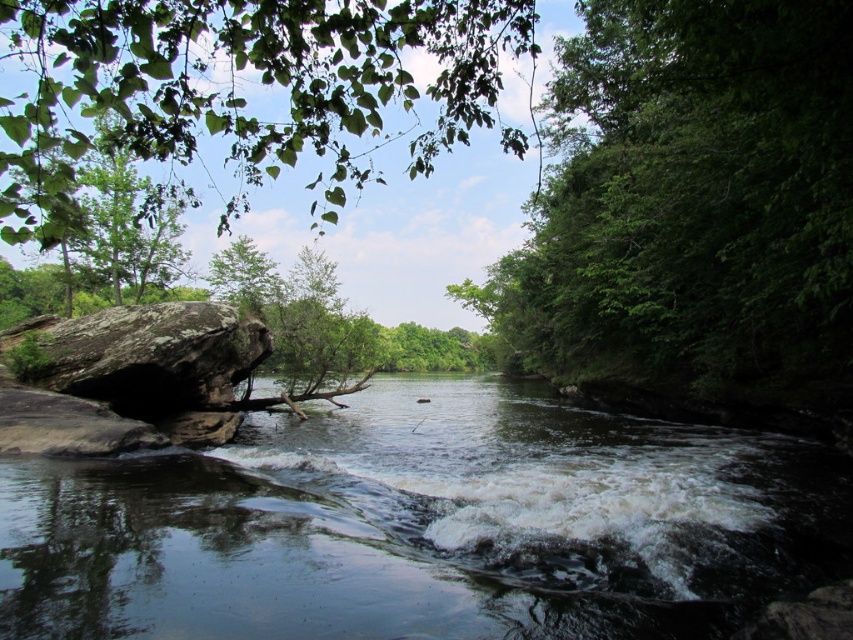
Can you confirm if green leafy tree at right is positioned to the left of green leafy tree at upper left?

In fact, green leafy tree at right is to the right of green leafy tree at upper left.

The height and width of the screenshot is (640, 853). What do you see at coordinates (692, 204) in the screenshot? I see `green leafy tree at right` at bounding box center [692, 204].

Where is `green leafy tree at right`? This screenshot has width=853, height=640. green leafy tree at right is located at coordinates (692, 204).

Locate an element on the screen. This screenshot has width=853, height=640. green leafy tree at right is located at coordinates (692, 204).

Which is in front, point (582, 618) or point (189, 362)?

Point (582, 618) is in front.

Is point (97, 604) farther from camera compared to point (195, 301)?

No, it is not.

Which is in front, point (625, 529) or point (236, 310)?

Point (625, 529)

Find the location of a particular element. This screenshot has width=853, height=640. smooth dark water at center is located at coordinates (425, 525).

Is green leafy tree at right positioned behind rough textured rock at left?

That is False.

Does green leafy tree at right have a greater width compared to rough textured rock at left?

Correct, the width of green leafy tree at right exceeds that of rough textured rock at left.

Identify the location of green leafy tree at right. The height and width of the screenshot is (640, 853). (692, 204).